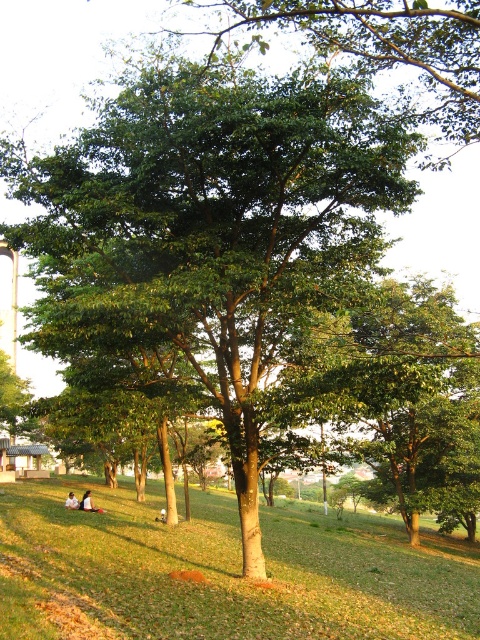
You are a photographer standing in the park and want to capture a photo of the green grassy field at center and the white cotton shirt at center. Which object should you focus on if you want the background to be slightly blurred while keeping the other in sharp focus?

To achieve a blurred background, focus on the white cotton shirt at center since it is closer to the camera than the green grassy field at center, which is further away. This depth of field effect will blur the background object.

You are a photographer standing in the park and want to capture a photo of the green grassy field at center and the white cotton shirt at lower left. Which object is higher in the image?

The green grassy field at center is taller than the white cotton shirt at lower left, so the green grassy field at center appears higher in the image.